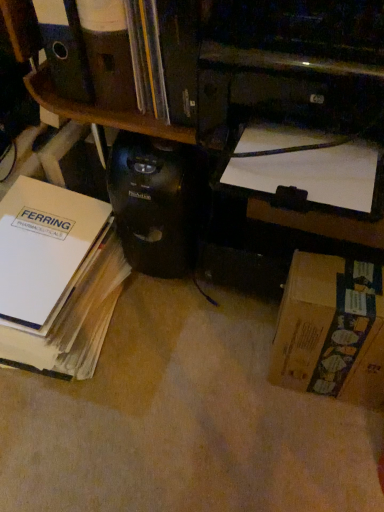
Question: Is white paper at upper right, which ranks as the 2th book in left-to-right order, positioned far away from brown cardboard box at lower right?

Choices:
 (A) no
 (B) yes

Answer: (A)

Question: Is brown cardboard box at lower right at the back of white paper at upper right, which is the first book in right-to-left order?

Choices:
 (A) no
 (B) yes

Answer: (A)

Question: Considering the relative sizes of white paper at upper right, which ranks as the 2th book in left-to-right order, and brown cardboard box at lower right in the image provided, is white paper at upper right, which ranks as the 2th book in left-to-right order, wider than brown cardboard box at lower right?

Choices:
 (A) yes
 (B) no

Answer: (B)

Question: Does white paper at upper right, which ranks as the 2th book in left-to-right order, turn towards brown cardboard box at lower right?

Choices:
 (A) yes
 (B) no

Answer: (A)

Question: From the image's perspective, would you say white paper at upper right, which is the first book in right-to-left order, is positioned over brown cardboard box at lower right?

Choices:
 (A) yes
 (B) no

Answer: (A)

Question: Is black plastic computer tower at center bigger or smaller than brown cardboard box at lower right?

Choices:
 (A) small
 (B) big

Answer: (B)

Question: From the image's perspective, is black plastic computer tower at center above or below brown cardboard box at lower right?

Choices:
 (A) above
 (B) below

Answer: (A)

Question: Choose the correct answer: Is black plastic computer tower at center inside brown cardboard box at lower right or outside it?

Choices:
 (A) outside
 (B) inside

Answer: (A)

Question: In terms of width, does black plastic computer tower at center look wider or thinner when compared to brown cardboard box at lower right?

Choices:
 (A) wide
 (B) thin

Answer: (A)

Question: Is black plastic printer at upper center bigger or smaller than brown cardboard box at lower right?

Choices:
 (A) small
 (B) big

Answer: (B)

Question: In terms of width, does black plastic printer at upper center look wider or thinner when compared to brown cardboard box at lower right?

Choices:
 (A) thin
 (B) wide

Answer: (B)

Question: Is black plastic printer at upper center to the left or to the right of brown cardboard box at lower right in the image?

Choices:
 (A) right
 (B) left

Answer: (B)

Question: Is black plastic printer at upper center in front of or behind brown cardboard box at lower right in the image?

Choices:
 (A) behind
 (B) front

Answer: (B)

Question: From the image's perspective, relative to black plastic computer tower at center, is black plastic printer at upper center above or below?

Choices:
 (A) above
 (B) below

Answer: (A)

Question: In terms of width, does black plastic printer at upper center look wider or thinner when compared to black plastic computer tower at center?

Choices:
 (A) thin
 (B) wide

Answer: (B)